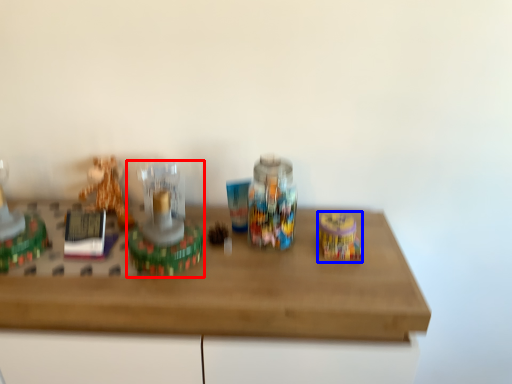
Question: Among these objects, which one is nearest to the camera, toy (highlighted by a red box) or toy (highlighted by a blue box)?

Choices:
 (A) toy
 (B) toy

Answer: (A)